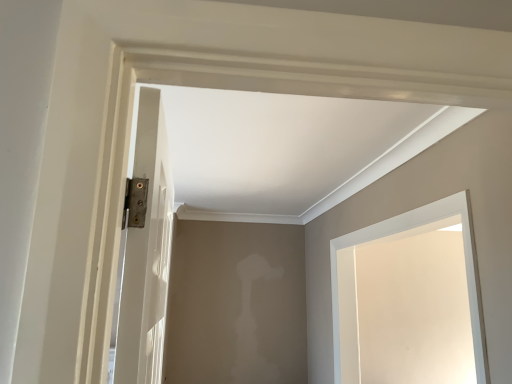
Locate an element on the screen. Image resolution: width=512 pixels, height=384 pixels. white glossy door at upper right is located at coordinates [x=401, y=236].

This screenshot has height=384, width=512. Describe the element at coordinates (401, 236) in the screenshot. I see `white glossy door at upper right` at that location.

This screenshot has height=384, width=512. I want to click on white glossy door at upper right, so click(401, 236).